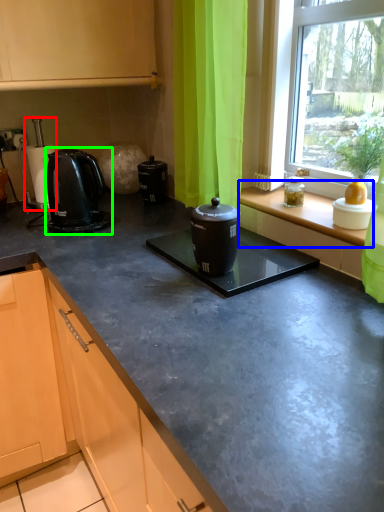
Question: Estimate the real-world distances between objects in this image. Which object is farther from coffee machine (highlighted by a red box), window sill (highlighted by a blue box) or home appliance (highlighted by a green box)?

Choices:
 (A) window sill
 (B) home appliance

Answer: (A)